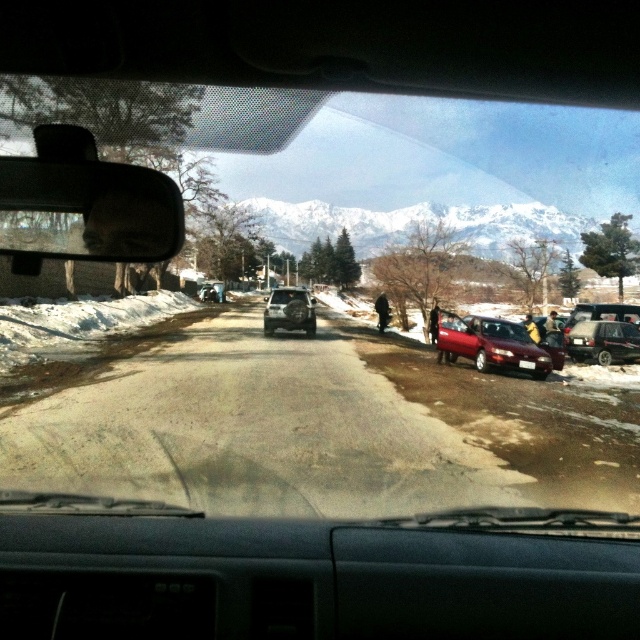
Question: Is satin silver suv at center below yellow fabric bag at right?

Choices:
 (A) no
 (B) yes

Answer: (A)

Question: Is metallic silver sedan at right wider than dark blue jacket at center?

Choices:
 (A) yes
 (B) no

Answer: (A)

Question: Among these objects, which one is farthest from the camera?

Choices:
 (A) light brown leather jacket at right
 (B) satin silver suv at center
 (C) yellow fabric bag at right

Answer: (B)

Question: Which of these objects is positioned farthest from the metallic silver sedan at right?

Choices:
 (A) dark blue jacket at center
 (B) matte red sedan at center
 (C) black fabric person at center

Answer: (C)

Question: Among these points, which one is farthest from the camera?

Choices:
 (A) (301, 292)
 (B) (616, 342)
 (C) (490, 321)

Answer: (A)

Question: Is light brown leather jacket at right above yellow fabric bag at right?

Choices:
 (A) yes
 (B) no

Answer: (B)